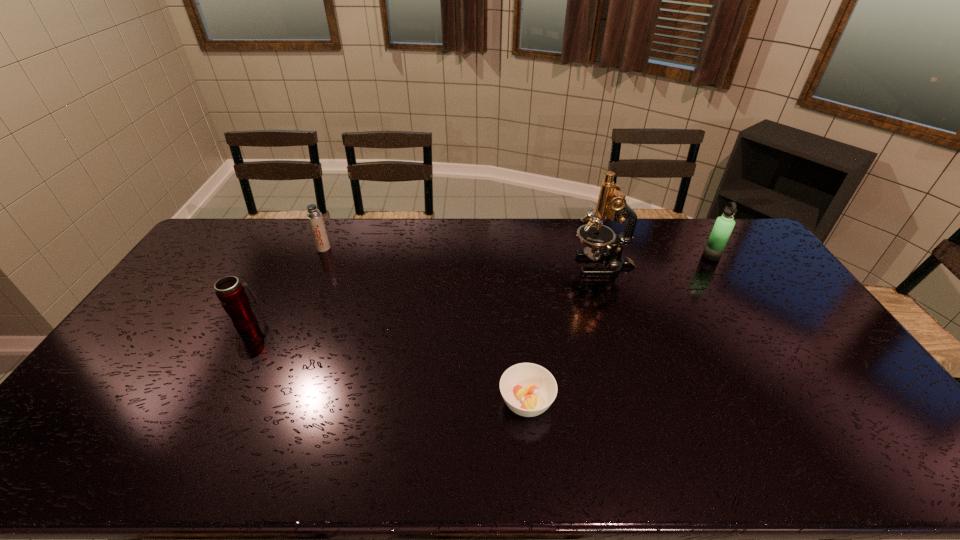
Locate an element on the screen. object located at the far right corner is located at coordinates (722, 229).

The image size is (960, 540). What are the coordinates of `free space at the far edge` in the screenshot? It's located at click(x=337, y=241).

Where is `vacant space at the near edge`? vacant space at the near edge is located at coordinates (538, 449).

What are the coordinates of `free space at the left edge of the desktop` in the screenshot? It's located at (201, 273).

Locate an element on the screen. This screenshot has width=960, height=540. vacant space at the right edge of the desktop is located at coordinates (803, 313).

At what (x,y) coordinates should I click in order to perform the action: click on blank area at the far left corner. Please return your answer as a coordinate pair (x, y). Looking at the image, I should click on (216, 248).

Where is `free point between the nearest object and the second thermos bottle from right to left`? free point between the nearest object and the second thermos bottle from right to left is located at coordinates (425, 325).

Locate an element on the screen. empty space between the leftmost thermos bottle and the soup bowl is located at coordinates (387, 362).

At what (x,y) coordinates should I click in order to perform the action: click on empty space between the rightmost object and the third object from right to left. Please return your answer as a coordinate pair (x, y). The height and width of the screenshot is (540, 960). Looking at the image, I should click on (619, 329).

Locate an element on the screen. The image size is (960, 540). unoccupied area between the leftmost thermos bottle and the second thermos bottle from left to right is located at coordinates (285, 286).